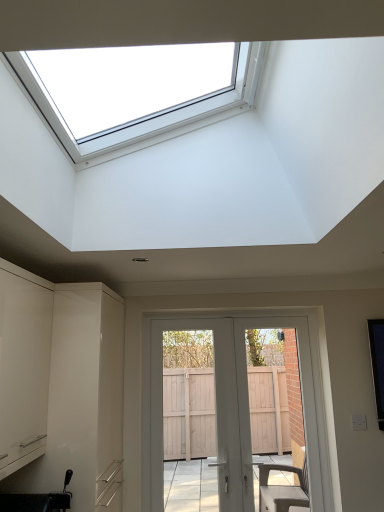
This screenshot has height=512, width=384. What do you see at coordinates (38, 500) in the screenshot?
I see `black plastic sink at lower left` at bounding box center [38, 500].

What do you see at coordinates (23, 366) in the screenshot? I see `white matte cabinet at left, which is the 1th cabinetry from front to back` at bounding box center [23, 366].

At what (x,y) coordinates should I click in order to perform the action: click on white glossy door at center. Please return your answer as a coordinate pair (x, y). The image size is (384, 512). Looking at the image, I should click on (226, 410).

In order to face white glossy door at center, should I rotate leftwards or rightwards?

Rotate your view right by about 6.087°.

Find the location of `black plastic sink at lower left`. black plastic sink at lower left is located at coordinates (38, 500).

Looking at this image, from the image's perspective, which object appears higher, white glossy door at center or white matte cabinet at left, which is the 1th cabinetry from front to back?

white matte cabinet at left, which is the 1th cabinetry from front to back.

Can you tell me how much white glossy door at center and white matte cabinet at left, the second cabinetry viewed from the back, differ in facing direction?

The angle between the facing direction of white glossy door at center and the facing direction of white matte cabinet at left, the second cabinetry viewed from the back, is 89.6 degrees.

Locate an element on the screen. door below the white matte cabinet at left, the second cabinetry viewed from the back (from a real-world perspective) is located at coordinates (226, 410).

Is the position of white glossy door at center more distant than that of white matte cabinet at left, which is the 1th cabinetry from front to back?

Yes, the depth of white glossy door at center is greater than that of white matte cabinet at left, which is the 1th cabinetry from front to back.

The height and width of the screenshot is (512, 384). I want to click on sink below the white glossy door at center (from a real-world perspective), so click(x=38, y=500).

Which of these two, white glossy door at center or black plastic sink at lower left, is smaller?

With smaller size is black plastic sink at lower left.

Considering their positions, is white glossy door at center located in front of or behind black plastic sink at lower left?

Clearly, white glossy door at center is behind black plastic sink at lower left.

Is white glossy door at center taller than black plastic sink at lower left?

Yes, white glossy door at center is taller than black plastic sink at lower left.

What's the angular difference between white glossy door at center and white glossy cabinet at left, placed as the 1th cabinetry when sorted from back to front,'s facing directions?

87.6 degrees.

From a real-world perspective, is white glossy door at center located beneath white glossy cabinet at left, the second cabinetry in the front-to-back sequence?

Yes.

Is white glossy door at center behind white glossy cabinet at left, placed as the 1th cabinetry when sorted from back to front?

Yes, it is.

From the image's perspective, is white glossy door at center above white glossy cabinet at left, placed as the 1th cabinetry when sorted from back to front?

No.

Does black plastic sink at lower left have a larger size compared to white glossy cabinet at left, the second cabinetry in the front-to-back sequence?

Actually, black plastic sink at lower left might be smaller than white glossy cabinet at left, the second cabinetry in the front-to-back sequence.

From the image's perspective, would you say black plastic sink at lower left is shown under white glossy cabinet at left, placed as the 1th cabinetry when sorted from back to front?

Yes.

Which of these two, black plastic sink at lower left or white glossy cabinet at left, the second cabinetry in the front-to-back sequence, stands taller?

Standing taller between the two is white glossy cabinet at left, the second cabinetry in the front-to-back sequence.

Could white glossy cabinet at left, placed as the 1th cabinetry when sorted from back to front, be considered to be inside black plastic sink at lower left?

No, white glossy cabinet at left, placed as the 1th cabinetry when sorted from back to front, is not inside black plastic sink at lower left.

Considering the sizes of black plastic sink at lower left and white matte cabinet at left, the second cabinetry viewed from the back, in the image, is black plastic sink at lower left wider or thinner than white matte cabinet at left, the second cabinetry viewed from the back,?

Clearly, black plastic sink at lower left has more width compared to white matte cabinet at left, the second cabinetry viewed from the back.

The width and height of the screenshot is (384, 512). I want to click on sink below the white matte cabinet at left, the second cabinetry viewed from the back (from the image's perspective), so click(x=38, y=500).

Which is behind, point (44, 506) or point (38, 349)?

Point (38, 349)

Which is closer to the camera, (21, 439) or (2, 301)?

Point (21, 439) appears to be farther away from the viewer than point (2, 301).

Is white glossy cabinet at left, the second cabinetry in the front-to-back sequence, in front of or behind white matte cabinet at left, which is the 1th cabinetry from front to back, in the image?

Visually, white glossy cabinet at left, the second cabinetry in the front-to-back sequence, is located behind white matte cabinet at left, which is the 1th cabinetry from front to back.

Can you confirm if white glossy cabinet at left, placed as the 1th cabinetry when sorted from back to front, is wider than white matte cabinet at left, the second cabinetry viewed from the back?

Indeed, white glossy cabinet at left, placed as the 1th cabinetry when sorted from back to front, has a greater width compared to white matte cabinet at left, the second cabinetry viewed from the back.

Considering the relative positions of white matte cabinet at left, the second cabinetry viewed from the back, and black plastic sink at lower left in the image provided, is white matte cabinet at left, the second cabinetry viewed from the back, in front of black plastic sink at lower left?

Yes, white matte cabinet at left, the second cabinetry viewed from the back, is closer to the camera.

Is white matte cabinet at left, the second cabinetry viewed from the back, positioned with its back to black plastic sink at lower left?

No, black plastic sink at lower left is not at the back of white matte cabinet at left, the second cabinetry viewed from the back.

I want to click on the 2nd cabinetry positioned above the black plastic sink at lower left (from a real-world perspective), so click(23, 366).

Which object is wider, white matte cabinet at left, which is the 1th cabinetry from front to back, or black plastic sink at lower left?

black plastic sink at lower left.

Image resolution: width=384 pixels, height=512 pixels. Find the location of `door directly beneath the white matte cabinet at left, which is the 1th cabinetry from front to back (from a real-world perspective)`. door directly beneath the white matte cabinet at left, which is the 1th cabinetry from front to back (from a real-world perspective) is located at coordinates point(226,410).

I want to click on door behind the black plastic sink at lower left, so click(226, 410).

Consider the image. Estimate the real-world distances between objects in this image. Which object is further from white matte cabinet at left, the second cabinetry viewed from the back, white glossy door at center or black plastic sink at lower left?

Based on the image, white glossy door at center appears to be further to white matte cabinet at left, the second cabinetry viewed from the back.

When comparing their distances from white glossy cabinet at left, the second cabinetry in the front-to-back sequence, does white glossy door at center or white matte cabinet at left, which is the 1th cabinetry from front to back, seem further?

white glossy door at center lies further to white glossy cabinet at left, the second cabinetry in the front-to-back sequence, than the other object.

Looking at this image, when comparing their distances from white glossy cabinet at left, the second cabinetry in the front-to-back sequence, does white matte cabinet at left, the second cabinetry viewed from the back, or white glossy door at center seem further?

white glossy door at center lies further to white glossy cabinet at left, the second cabinetry in the front-to-back sequence, than the other object.

Considering their positions, is black plastic sink at lower left positioned closer to white matte cabinet at left, the second cabinetry viewed from the back, than white glossy door at center?

black plastic sink at lower left lies closer to white matte cabinet at left, the second cabinetry viewed from the back, than the other object.

From the image, which object appears to be farther from white glossy door at center, white glossy cabinet at left, the second cabinetry in the front-to-back sequence, or white matte cabinet at left, the second cabinetry viewed from the back?

white matte cabinet at left, the second cabinetry viewed from the back, lies further to white glossy door at center than the other object.

From the image, which object appears to be farther from white matte cabinet at left, the second cabinetry viewed from the back, white glossy door at center or white glossy cabinet at left, the second cabinetry in the front-to-back sequence?

Among the two, white glossy door at center is located further to white matte cabinet at left, the second cabinetry viewed from the back.

Estimate the real-world distances between objects in this image. Which object is closer to white glossy cabinet at left, placed as the 1th cabinetry when sorted from back to front, black plastic sink at lower left or white matte cabinet at left, which is the 1th cabinetry from front to back?

Among the two, white matte cabinet at left, which is the 1th cabinetry from front to back, is located nearer to white glossy cabinet at left, placed as the 1th cabinetry when sorted from back to front.

Based on their spatial positions, is black plastic sink at lower left or white glossy door at center closer to white glossy cabinet at left, the second cabinetry in the front-to-back sequence?

The object closer to white glossy cabinet at left, the second cabinetry in the front-to-back sequence, is black plastic sink at lower left.

Identify the location of cabinetry that lies between white matte cabinet at left, the second cabinetry viewed from the back, and black plastic sink at lower left from top to bottom. (60, 381).

Where is `cabinetry between white matte cabinet at left, which is the 1th cabinetry from front to back, and white glossy door at center, along the z-axis`? The width and height of the screenshot is (384, 512). cabinetry between white matte cabinet at left, which is the 1th cabinetry from front to back, and white glossy door at center, along the z-axis is located at coordinates (60, 381).

Where is `sink between white glossy cabinet at left, the second cabinetry in the front-to-back sequence, and white glossy door at center`? sink between white glossy cabinet at left, the second cabinetry in the front-to-back sequence, and white glossy door at center is located at coordinates (38, 500).

In order to click on sink located between white matte cabinet at left, the second cabinetry viewed from the back, and white glossy door at center in the depth direction in this screenshot , I will do (38, 500).